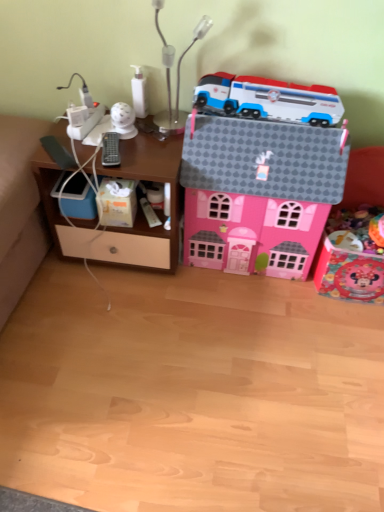
The width and height of the screenshot is (384, 512). Identify the location of unoccupied region to the right of white glossy bottle at upper center, positioned as the 5th toy in right-to-left order. (162, 124).